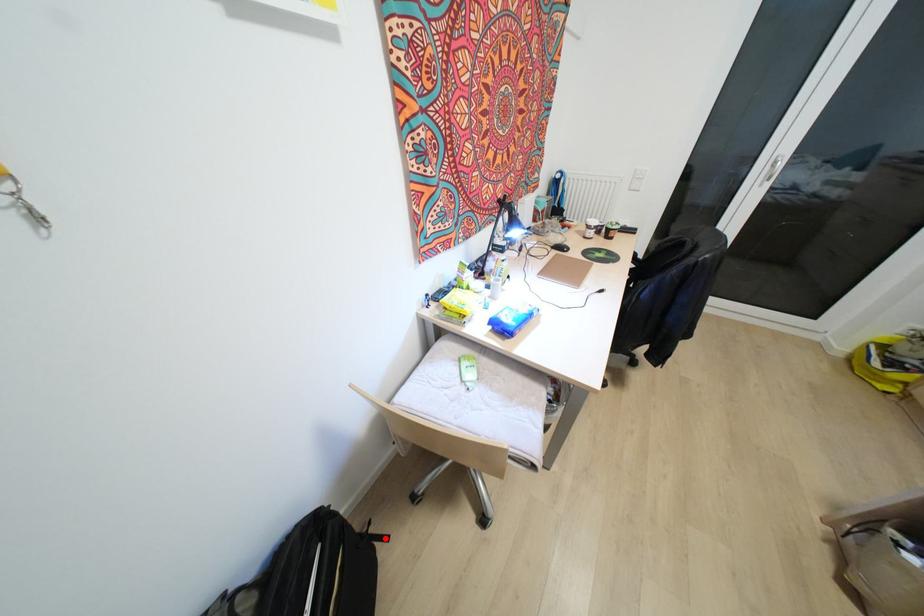
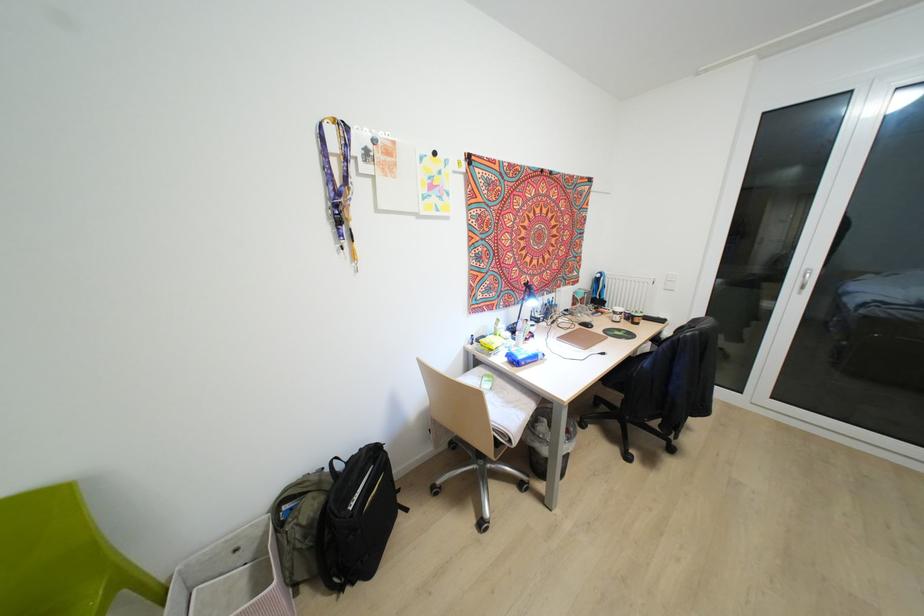
The point at the highlighted location is marked in the first image. Where is the corresponding point in the second image?

(406, 509)